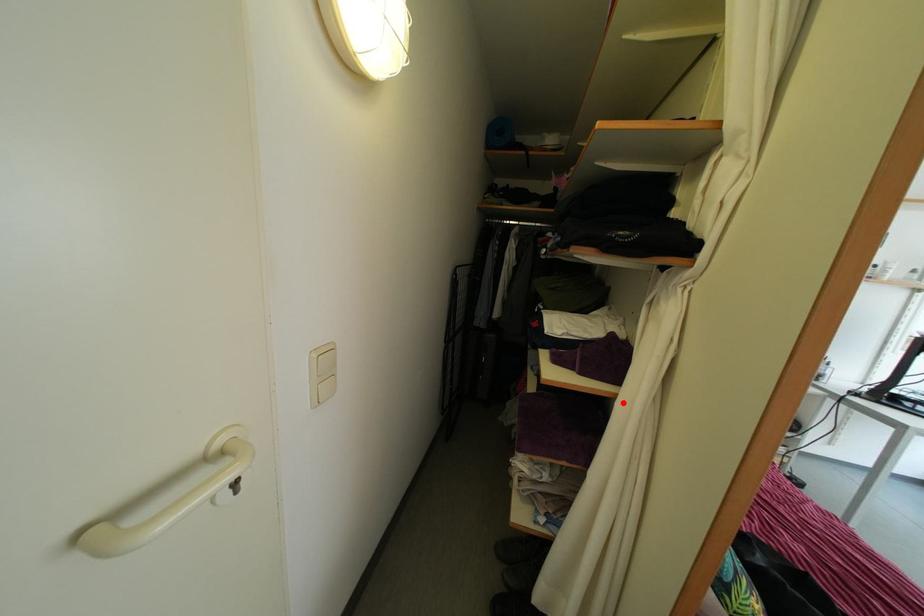
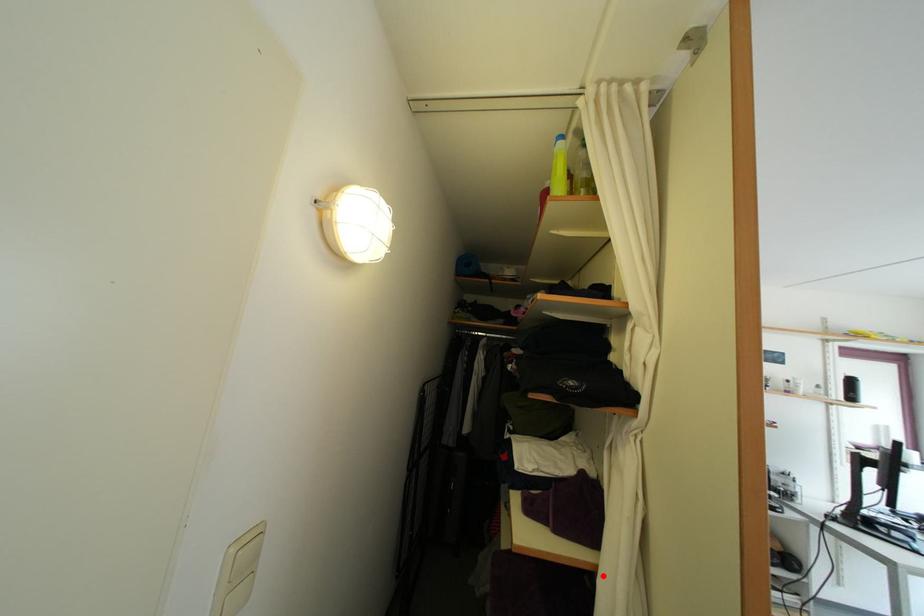
I am providing you with two images of the same scene from different viewpoints. A red point is marked on the first image and another point is marked on the second image. Is the red point in image1 aligned with the point shown in image2?

Yes